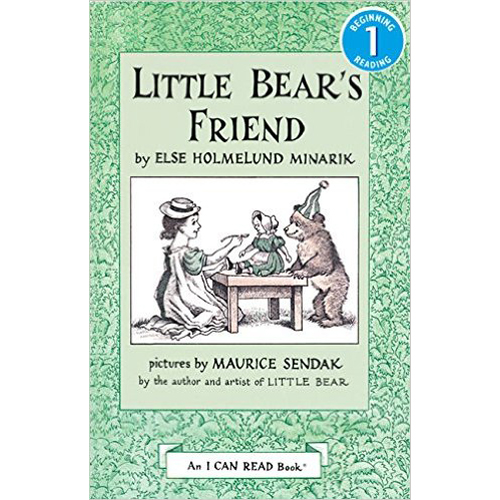
You are a GUI agent. You are given a task and a screenshot of the screen. Output one action in this format:
    pyautogui.click(x=<x>, y=<y>)
    Task: Click on the spoon
    
    Given the screenshot: What is the action you would take?
    pyautogui.click(x=246, y=234)